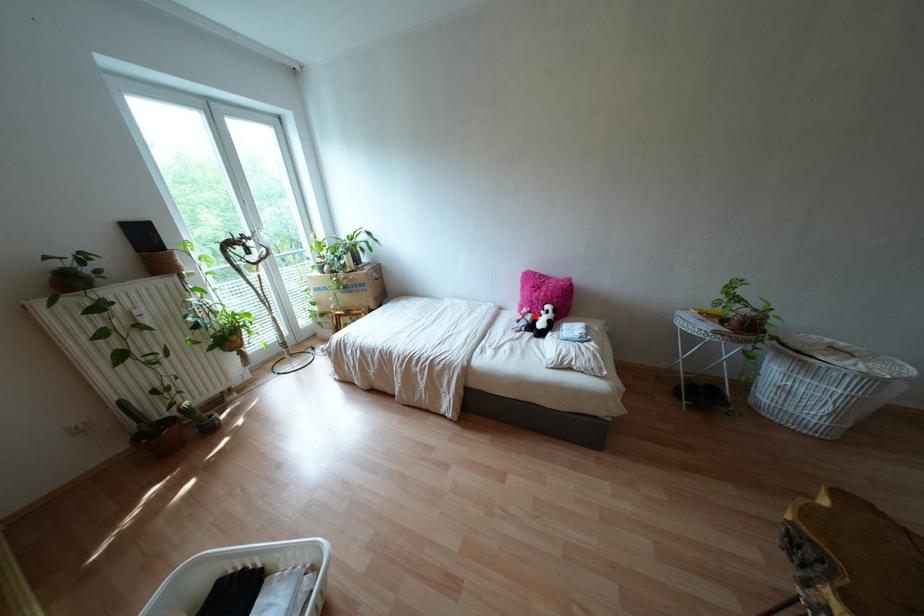
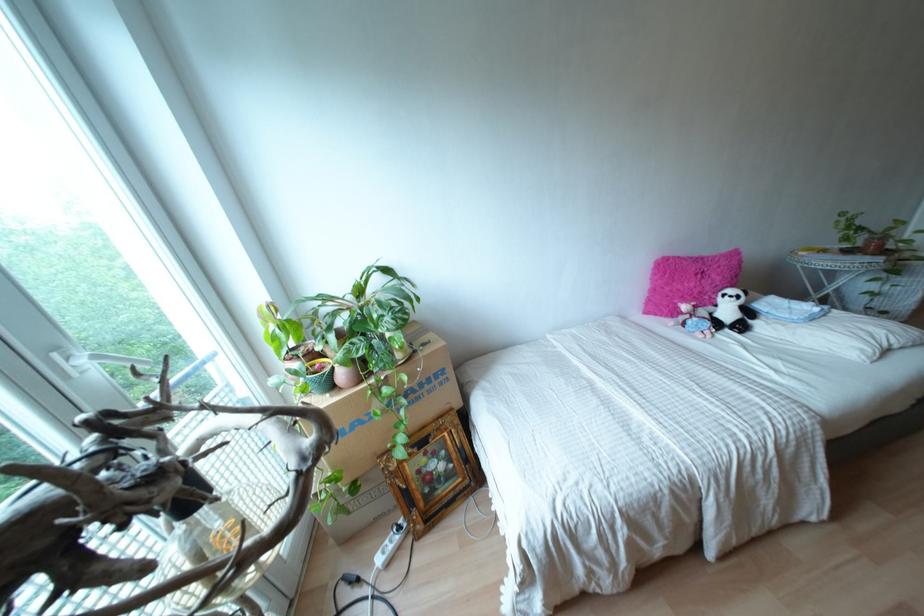
In the second image, find the point that corresponds to the highlighted location in the first image.

(710, 308)